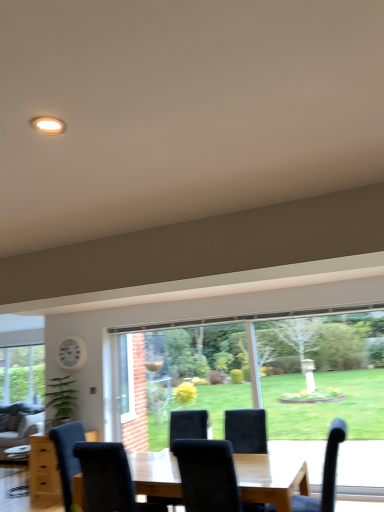
You are a GUI agent. You are given a task and a screenshot of the screen. Output one action in this format:
    pyautogui.click(x=<x>, y=<y>)
    Task: Click on the white plastic clock at upper left
    
    Given the screenshot: What is the action you would take?
    pyautogui.click(x=71, y=353)

Locate an element on the screen. The width and height of the screenshot is (384, 512). velvet grey couch at lower left is located at coordinates (19, 424).

Does velvet black chair at center, the 2th chair positioned from the right, have a greater width compared to white plastic clock at upper left?

Yes.

I want to click on clock positioned vertically above the velvet black chair at center, the 2th chair positioned from the right (from a real-world perspective), so click(x=71, y=353).

Is velvet black chair at center, which is the 1th chair in left-to-right order, completely or partially outside of white plastic clock at upper left?

velvet black chair at center, which is the 1th chair in left-to-right order, is positioned outside white plastic clock at upper left.

Would you say velvet black chair at center, which is the 1th chair in left-to-right order, is to the left or to the right of white plastic clock at upper left in the picture?

From the image, it's evident that velvet black chair at center, which is the 1th chair in left-to-right order, is to the right of white plastic clock at upper left.

Could you tell me if velvet black chair at lower right, marked as the 2th chair in a left-to-right arrangement, is turned towards velvet grey couch at lower left?

No, velvet black chair at lower right, marked as the 2th chair in a left-to-right arrangement, is not facing towards velvet grey couch at lower left.

This screenshot has height=512, width=384. Find the location of `chair that is the 1st object located in front of the velvet grey couch at lower left`. chair that is the 1st object located in front of the velvet grey couch at lower left is located at coordinates (325, 474).

What's the angular difference between velvet black chair at lower right, marked as the 2th chair in a left-to-right arrangement, and velvet grey couch at lower left's facing directions?

The facing directions of velvet black chair at lower right, marked as the 2th chair in a left-to-right arrangement, and velvet grey couch at lower left are 87.9 degrees apart.

Based on the photo, measure the distance between velvet black chair at lower right, acting as the 1th chair starting from the right, and velvet grey couch at lower left.

They are 3.65 meters apart.

From the image's perspective, relative to velvet black chair at center, which is the 1th chair in left-to-right order, is velvet grey couch at lower left above or below?

velvet grey couch at lower left is below velvet black chair at center, which is the 1th chair in left-to-right order.

Would you say velvet grey couch at lower left is a long distance from velvet black chair at center, the 2th chair positioned from the right?

velvet grey couch at lower left is far away from velvet black chair at center, the 2th chair positioned from the right.

Can you confirm if velvet grey couch at lower left is taller than velvet black chair at center, which is the 1th chair in left-to-right order?

Indeed, velvet grey couch at lower left has a greater height compared to velvet black chair at center, which is the 1th chair in left-to-right order.

Could velvet black chair at center, which is the 1th chair in left-to-right order, be considered to be inside velvet grey couch at lower left?

That's incorrect, velvet black chair at center, which is the 1th chair in left-to-right order, is not inside velvet grey couch at lower left.

Does velvet black chair at lower right, acting as the 1th chair starting from the right, lie behind white plastic clock at upper left?

No, velvet black chair at lower right, acting as the 1th chair starting from the right, is closer to the camera.

Identify the location of clock located behind the velvet black chair at lower right, acting as the 1th chair starting from the right. coord(71,353).

Is velvet black chair at lower right, marked as the 2th chair in a left-to-right arrangement, situated inside white plastic clock at upper left or outside?

velvet black chair at lower right, marked as the 2th chair in a left-to-right arrangement, is located beyond the bounds of white plastic clock at upper left.

Which is in front, point (325, 510) or point (78, 355)?

Point (325, 510)

From the image's perspective, relative to velvet black chair at center, the 2th chair positioned from the right, is white plastic clock at upper left above or below?

From the image's perspective, white plastic clock at upper left appears above velvet black chair at center, the 2th chair positioned from the right.

Is point (79, 336) closer or farther from the camera than point (230, 463)?

Point (79, 336) is farther from the camera than point (230, 463).

What are the coordinates of `clock positioned vertically above the velvet black chair at center, the 2th chair positioned from the right (from a real-world perspective)` in the screenshot? It's located at [x=71, y=353].

Is velvet black chair at center, the 2th chair positioned from the right, positioned beyond the bounds of velvet black chair at lower right, marked as the 2th chair in a left-to-right arrangement?

Indeed, velvet black chair at center, the 2th chair positioned from the right, is completely outside velvet black chair at lower right, marked as the 2th chair in a left-to-right arrangement.

Looking at their sizes, would you say velvet black chair at center, which is the 1th chair in left-to-right order, is wider or thinner than velvet black chair at lower right, marked as the 2th chair in a left-to-right arrangement?

Considering their sizes, velvet black chair at center, which is the 1th chair in left-to-right order, looks broader than velvet black chair at lower right, marked as the 2th chair in a left-to-right arrangement.

From the image's perspective, which one is positioned higher, velvet black chair at center, the 2th chair positioned from the right, or velvet black chair at lower right, marked as the 2th chair in a left-to-right arrangement?

velvet black chair at center, the 2th chair positioned from the right, is shown above in the image.

Which object is further away from the camera, white plastic clock at upper left or velvet black chair at lower right, acting as the 1th chair starting from the right?

white plastic clock at upper left is further from the camera.

Identify the location of chair that is the 2nd object to the right of the white plastic clock at upper left, starting at the anchor. The image size is (384, 512). (325, 474).

In the scene shown: Is white plastic clock at upper left facing towards velvet black chair at lower right, acting as the 1th chair starting from the right?

No.

Considering the points (74, 367) and (330, 461), which point is behind, point (74, 367) or point (330, 461)?

The point (74, 367) is behind.

Where is `clock above the velvet black chair at center, the 2th chair positioned from the right (from the image's perspective)`? The width and height of the screenshot is (384, 512). clock above the velvet black chair at center, the 2th chair positioned from the right (from the image's perspective) is located at coordinates (71, 353).

This screenshot has height=512, width=384. Identify the location of chair that is the 2nd object to the right of the velvet grey couch at lower left, starting at the anchor. (325, 474).

When comparing their distances from velvet black chair at lower right, acting as the 1th chair starting from the right, does velvet grey couch at lower left or velvet black chair at center, the 2th chair positioned from the right, seem closer?

velvet black chair at center, the 2th chair positioned from the right.

Estimate the real-world distances between objects in this image. Which object is further from white plastic clock at upper left, velvet black chair at lower right, acting as the 1th chair starting from the right, or velvet grey couch at lower left?

velvet black chair at lower right, acting as the 1th chair starting from the right, lies further to white plastic clock at upper left than the other object.

From the picture: Based on their spatial positions, is white plastic clock at upper left or velvet black chair at center, the 2th chair positioned from the right, closer to velvet grey couch at lower left?

white plastic clock at upper left is closer to velvet grey couch at lower left.

When comparing their distances from white plastic clock at upper left, does velvet black chair at lower right, marked as the 2th chair in a left-to-right arrangement, or velvet black chair at center, which is the 1th chair in left-to-right order, seem further?

Among the two, velvet black chair at lower right, marked as the 2th chair in a left-to-right arrangement, is located further to white plastic clock at upper left.

When comparing their distances from velvet grey couch at lower left, does velvet black chair at center, which is the 1th chair in left-to-right order, or white plastic clock at upper left seem further?

Among the two, velvet black chair at center, which is the 1th chair in left-to-right order, is located further to velvet grey couch at lower left.

Based on their spatial positions, is velvet black chair at center, which is the 1th chair in left-to-right order, or velvet black chair at lower right, marked as the 2th chair in a left-to-right arrangement, closer to velvet grey couch at lower left?

Based on the image, velvet black chair at center, which is the 1th chair in left-to-right order, appears to be nearer to velvet grey couch at lower left.

Looking at the image, which one is located further to velvet grey couch at lower left, white plastic clock at upper left or velvet black chair at lower right, acting as the 1th chair starting from the right?

velvet black chair at lower right, acting as the 1th chair starting from the right, lies further to velvet grey couch at lower left than the other object.

Based on their spatial positions, is velvet black chair at lower right, marked as the 2th chair in a left-to-right arrangement, or velvet grey couch at lower left further from velvet black chair at center, the 2th chair positioned from the right?

The object further to velvet black chair at center, the 2th chair positioned from the right, is velvet grey couch at lower left.

Locate an element on the screen. This screenshot has width=384, height=512. clock between velvet black chair at lower right, marked as the 2th chair in a left-to-right arrangement, and velvet grey couch at lower left in the front-back direction is located at coordinates (71, 353).

What are the coordinates of `chair between velvet black chair at center, the 2th chair positioned from the right, and velvet grey couch at lower left, along the z-axis` in the screenshot? It's located at (325, 474).

Locate an element on the screen. The image size is (384, 512). chair positioned between velvet black chair at center, the 2th chair positioned from the right, and white plastic clock at upper left from near to far is located at coordinates (325, 474).

Where is `clock between velvet black chair at center, which is the 1th chair in left-to-right order, and velvet grey couch at lower left from front to back`? Image resolution: width=384 pixels, height=512 pixels. clock between velvet black chair at center, which is the 1th chair in left-to-right order, and velvet grey couch at lower left from front to back is located at coordinates (71, 353).